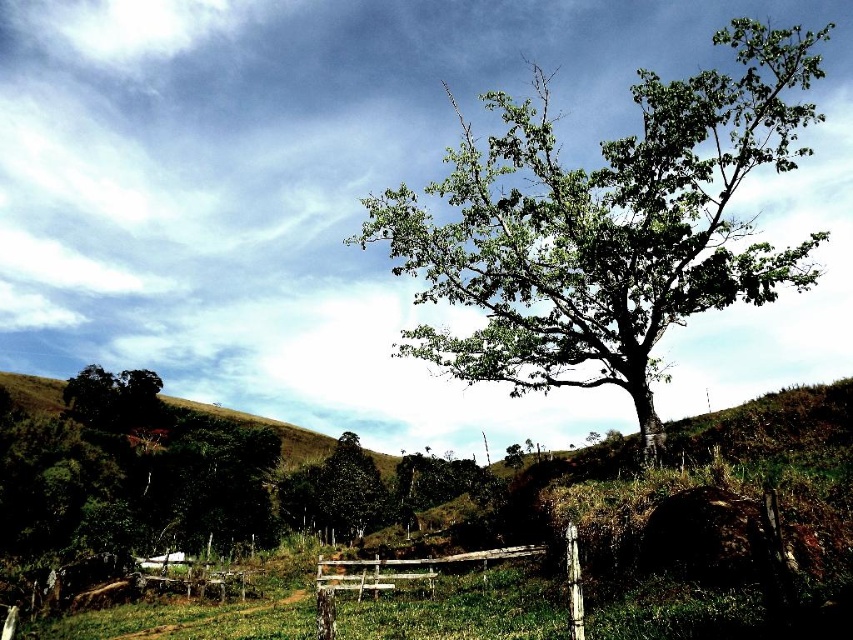
Question: Can you confirm if green leafy tree at center is smaller than wooden fence at lower center?

Choices:
 (A) no
 (B) yes

Answer: (A)

Question: Which point is farther from the camera taking this photo?

Choices:
 (A) (322, 628)
 (B) (85, 371)
 (C) (785, 42)

Answer: (C)

Question: Which object is farther from the camera taking this photo?

Choices:
 (A) wooden fence at lower center
 (B) green leafy tree at center
 (C) dark green leafy tree at lower left

Answer: (C)

Question: In this image, where is wooden fence at lower center located relative to dark green leafy tree at lower left?

Choices:
 (A) right
 (B) left

Answer: (A)

Question: Can you confirm if green leafy tree at center is positioned above dark green leafy tree at lower left?

Choices:
 (A) yes
 (B) no

Answer: (A)

Question: Which of the following is the farthest from the observer?

Choices:
 (A) (431, 564)
 (B) (643, 400)
 (C) (160, 384)

Answer: (C)